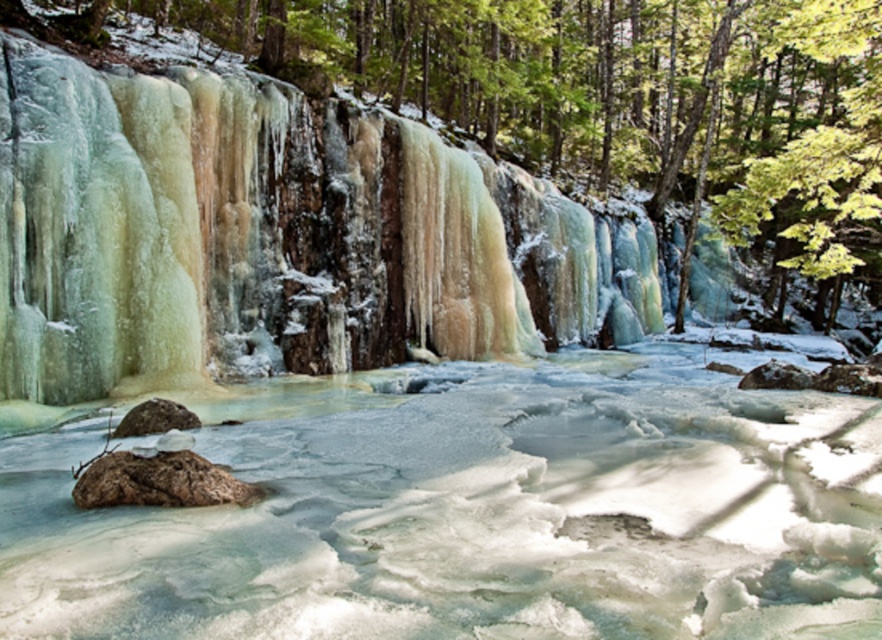
You are standing at the point marked as point (273, 236) in the winter landscape. Looking around, you see the icy translucent waterfall at center. Which direction should you face to see the icy translucent waterfall at center?

You are already at the point marked as point (273, 236), which is where the icy translucent waterfall at center is located. Therefore, you are standing at the waterfall itself.

You are an explorer trying to cross the river. You see the icy translucent waterfall at center and the brown rough rock at center. Which object should you avoid stepping on to ensure safety?

You should avoid stepping on the icy translucent waterfall at center because it is positioned on the right side of the brown rough rock at center, which is more stable due to its rough and solid structure.

From the picture: You are an explorer trying to cross the frozen river. You see the translucent ice water at center and the brown rough rock at lower left. Which one is wider? Please choose between the two.

The translucent ice water at center is wider than the brown rough rock at lower left.